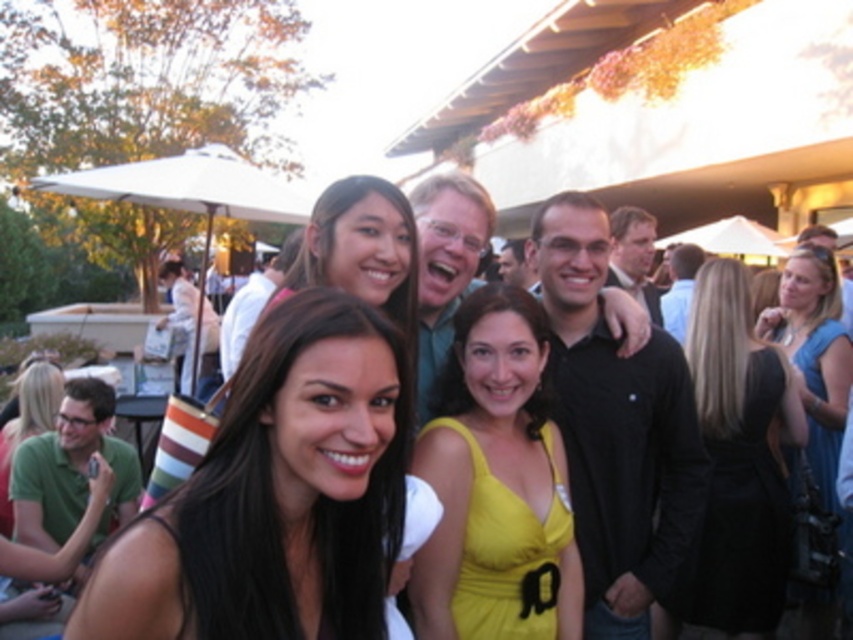
Does matte green shirt at center appear on the right side of matte green dress at lower left?

Indeed, matte green shirt at center is positioned on the right side of matte green dress at lower left.

Based on the photo, can you confirm if matte green shirt at center is positioned below matte green dress at lower left?

Actually, matte green shirt at center is above matte green dress at lower left.

Does point (491, 202) lie in front of point (0, 481)?

Yes.

Locate an element on the screen. The width and height of the screenshot is (853, 640). matte green shirt at center is located at coordinates (445, 264).

Which is behind, point (573, 436) or point (654, 298)?

The point (654, 298) is behind.

Can you confirm if black matte shirt at center is smaller than matte black shirt at center?

Indeed, black matte shirt at center has a smaller size compared to matte black shirt at center.

Does point (577, 371) lie in front of point (612, 221)?

Yes, it is in front of point (612, 221).

I want to click on black matte shirt at center, so click(x=614, y=428).

How far apart are blue satin dress at right and matte green dress at lower left?

They are 4.14 meters apart.

From the picture: Which is above, blue satin dress at right or matte green dress at lower left?

blue satin dress at right

The width and height of the screenshot is (853, 640). Find the location of `blue satin dress at right`. blue satin dress at right is located at coordinates (814, 355).

Locate an element on the screen. This screenshot has width=853, height=640. blue satin dress at right is located at coordinates (814, 355).